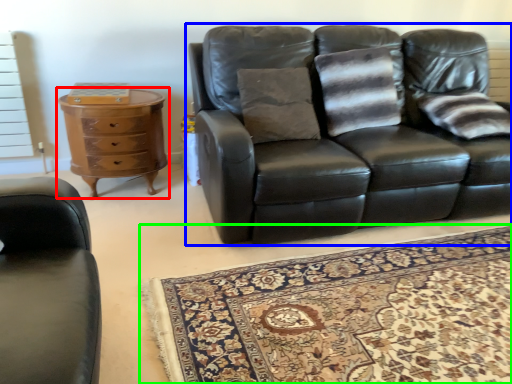
Question: Considering the real-world distances, which object is closest to chest of drawers (highlighted by a red box)? studio couch (highlighted by a blue box) or mat (highlighted by a green box).

Choices:
 (A) studio couch
 (B) mat

Answer: (A)